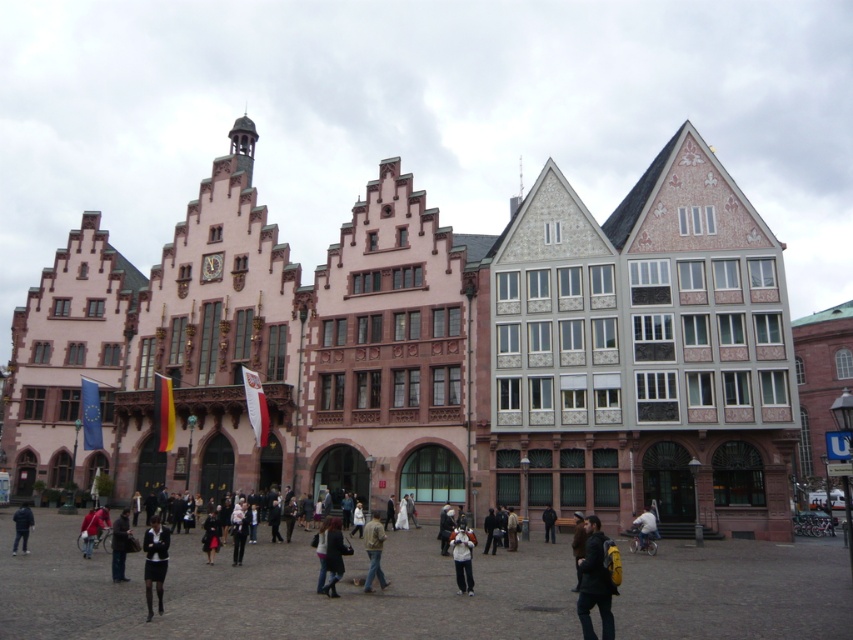
You are a photographer trying to capture both the white cotton jacket at center and the light blue denim jacket at lower center in the same frame. Based on their sizes, which jacket will appear larger in your photo?

The white cotton jacket at center will appear larger in the photo because it is bigger than the light blue denim jacket at lower center.

You are a photographer positioned in the square and want to capture both the dark brown leather jacket at lower right and the white cotton jacket at center in a single frame. Which jacket will appear taller in the photo?

The dark brown leather jacket at lower right will appear taller in the photo as it has a greater height compared to the white cotton jacket at center.

You are standing in the square and see the dark brown leather jacket at lower right. If you want to approach it, which direction should you walk from your current position at point 0,0?

You should walk towards the lower right direction to reach the dark brown leather jacket at lower right, as it is located at point (595, 582).